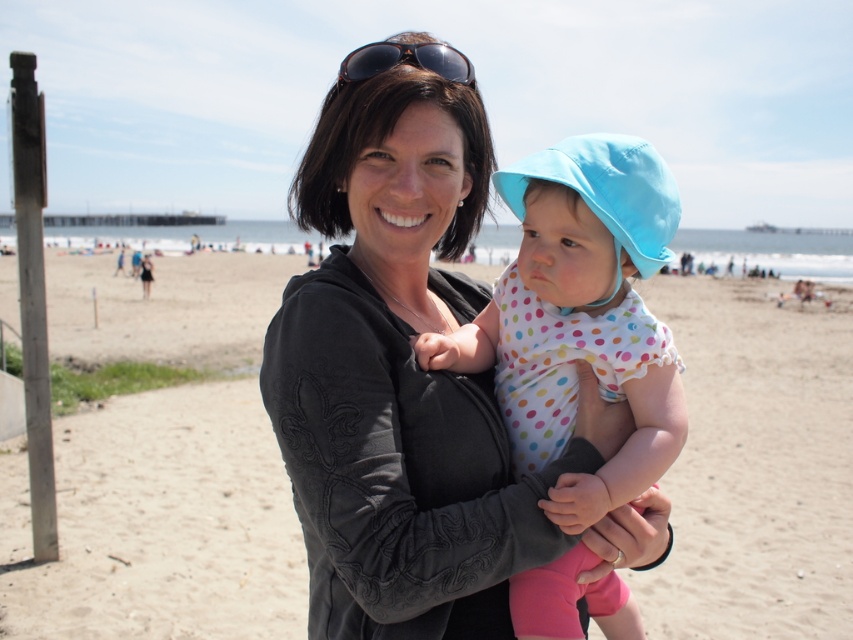
You are designing a beachwear collection and need to know the relative sizes of the polka dot fabric sunsuit at center and the brown textured sunglasses at upper center. Which one is wider?

The polka dot fabric sunsuit at center is less than the brown textured sunglasses at upper center in width, so the brown textured sunglasses at upper center is wider.

You are a photographer trying to capture a closeup of the brown textured sunglasses at upper center without including the beige sand at center in the frame. Given their sizes, is this possible?

The beige sand at center is larger in size than brown textured sunglasses at upper center. Therefore, it might be challenging to frame the sunglasses without including the sand if the sand occupies a more prominent area in the image.

In the scene shown: You are a photographer trying to capture a closeup of the polka dot fabric sunsuit at center and the brown textured sunglasses at upper center. Which object should you zoom in on first to ensure it fits entirely within the frame?

The polka dot fabric sunsuit at center is not as tall as the brown textured sunglasses at upper center, so you should zoom in on the brown textured sunglasses at upper center first to ensure it fits entirely within the frame.